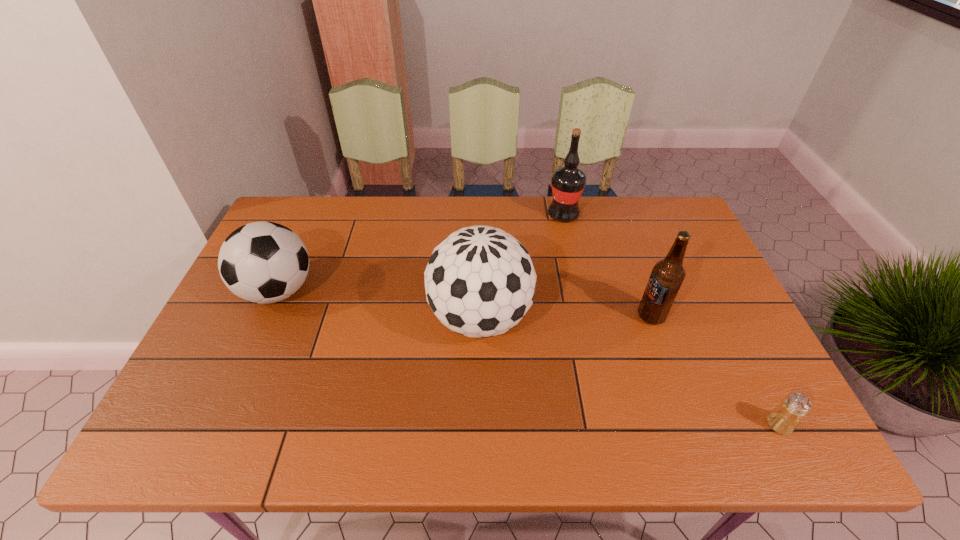
This screenshot has width=960, height=540. What are the coordinates of `wine bottle` in the screenshot? It's located at (568, 182).

This screenshot has width=960, height=540. I want to click on the farthest object, so click(x=568, y=182).

Locate an element on the screen. the second object from right to left is located at coordinates (667, 276).

Find the location of `the taller soccer ball`. the taller soccer ball is located at coordinates (480, 281).

At what (x,y) coordinates should I click in order to perform the action: click on the fourth object from right to left. Please return your answer as a coordinate pair (x, y). Looking at the image, I should click on (480, 281).

The width and height of the screenshot is (960, 540). In order to click on the leftmost object in this screenshot , I will do `click(262, 262)`.

This screenshot has height=540, width=960. Find the location of `the shorter soccer ball`. the shorter soccer ball is located at coordinates (262, 262).

Locate an element on the screen. This screenshot has width=960, height=540. the nearest object is located at coordinates (784, 419).

Where is `the shortest object`? The width and height of the screenshot is (960, 540). the shortest object is located at coordinates (784, 419).

Image resolution: width=960 pixels, height=540 pixels. In order to click on free spot located 0.050m on the back of the wine bottle in this screenshot , I will do `click(560, 197)`.